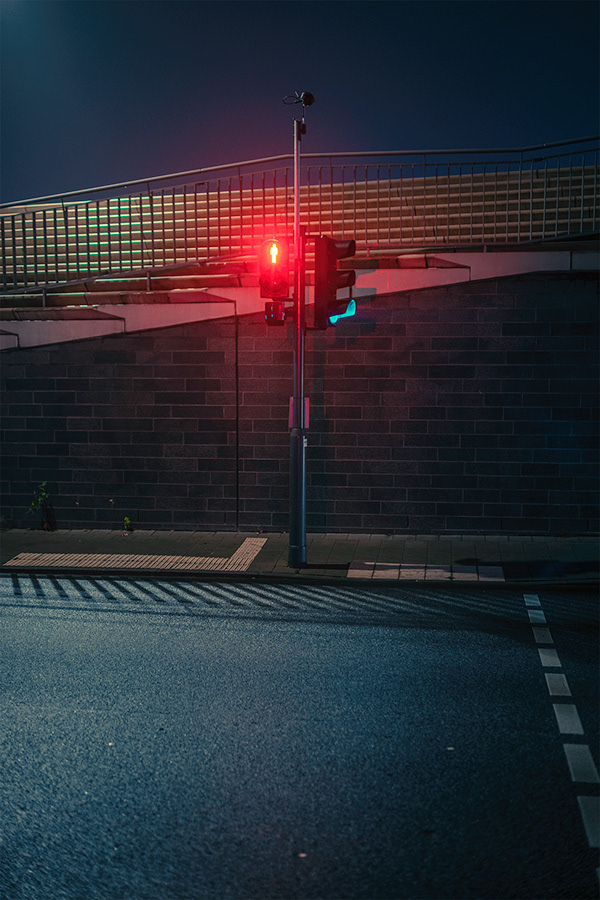
Locate an element on the screen. Image resolution: width=600 pixels, height=900 pixels. wall is located at coordinates (498, 382).